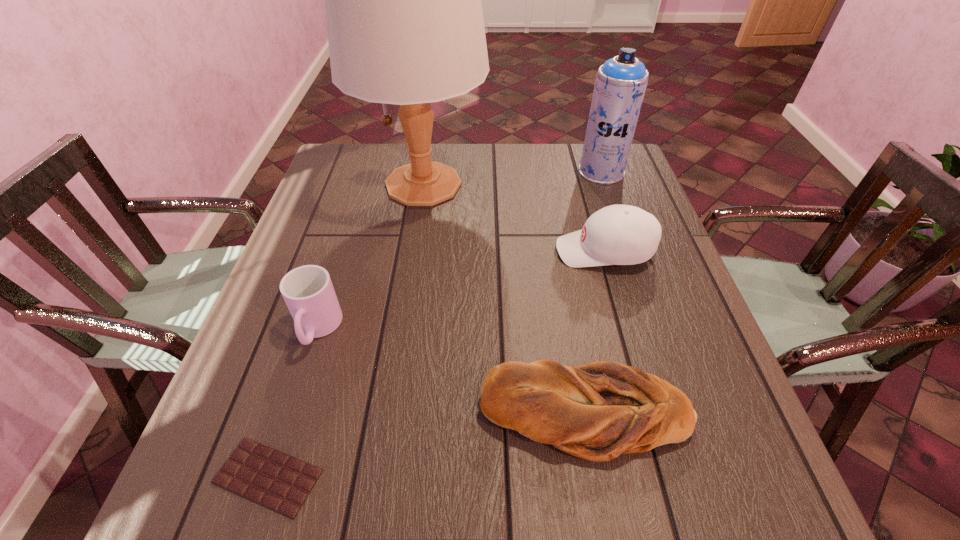
Find the location of `free region at the right edge of the desktop`. free region at the right edge of the desktop is located at coordinates (727, 390).

The width and height of the screenshot is (960, 540). In the image, there is a desktop. Identify the location of free space at the far left corner. (377, 153).

Locate an element on the screen. empty location between the bread and the baseball cap is located at coordinates (595, 333).

Identify the location of vacant space in between the shortest object and the third farthest object. This screenshot has height=540, width=960. (436, 363).

I want to click on free space between the baseball cap and the bread, so click(595, 333).

Locate an element on the screen. Image resolution: width=960 pixels, height=540 pixels. free space between the tallest object and the third farthest object is located at coordinates (514, 218).

You are a GUI agent. You are given a task and a screenshot of the screen. Output one action in this format:
    pyautogui.click(x=<x>, y=<y>)
    Task: Click on the unoccupied position between the fifth shortest object and the tallest object
    
    Given the screenshot: What is the action you would take?
    pyautogui.click(x=513, y=178)

Locate an element on the screen. This screenshot has height=540, width=960. free space between the bread and the fourth nearest object is located at coordinates (595, 333).

This screenshot has height=540, width=960. Find the location of `unoccupied position between the chocolate bar and the fourth nearest object`. unoccupied position between the chocolate bar and the fourth nearest object is located at coordinates (436, 363).

I want to click on vacant area that lies between the fourth farthest object and the fifth shortest object, so click(460, 251).